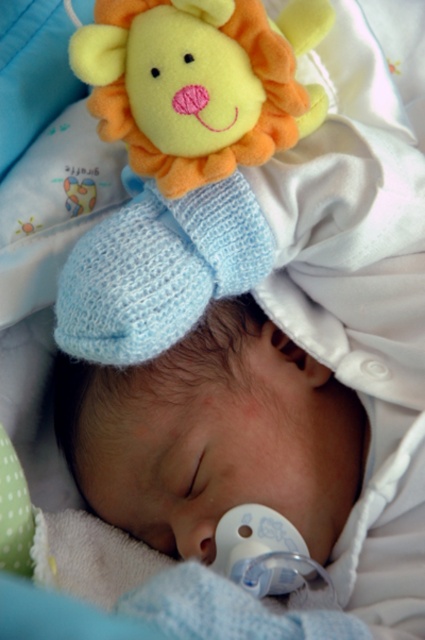
You are a parent checking on your baby. You notice the soft yellow plush lion at upper center and the white smooth pacifier at center. Which object is bigger?

The soft yellow plush lion at upper center is bigger than the white smooth pacifier at center.

You are a parent checking on your baby. You notice the soft yellow plush lion at upper center and the white smooth pacifier at center. Which object is closer to you?

The soft yellow plush lion at upper center is closer to you because it is in front of the white smooth pacifier at center.